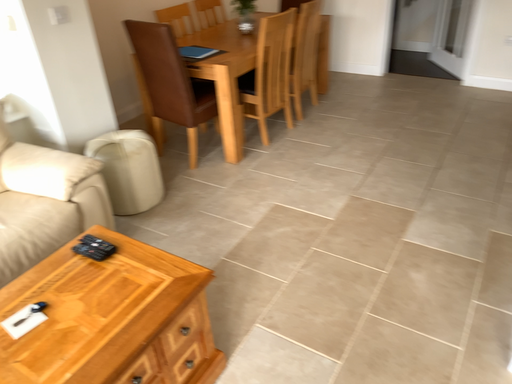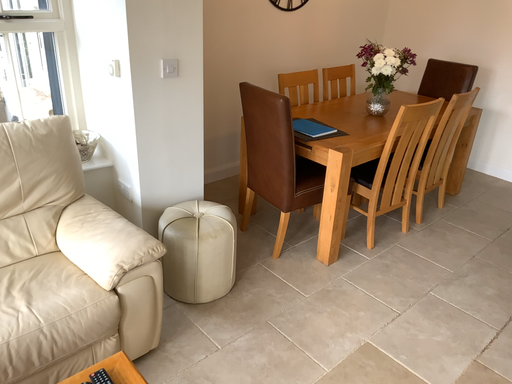
Question: How did the camera likely rotate when shooting the video?

Choices:
 (A) rotated right
 (B) rotated left

Answer: (B)